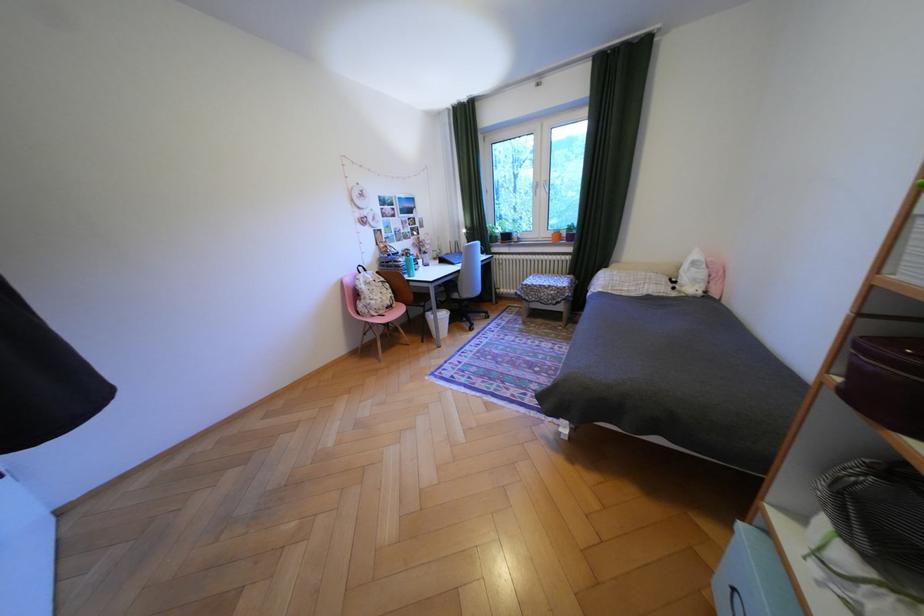
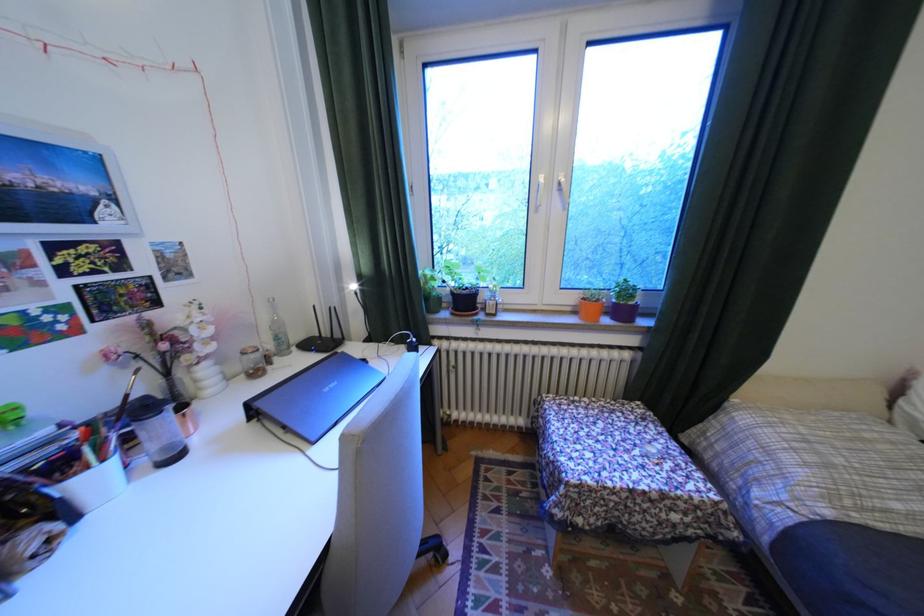
Locate, in the second image, the point that corresponds to pixel 507 237 in the first image.

(451, 299)